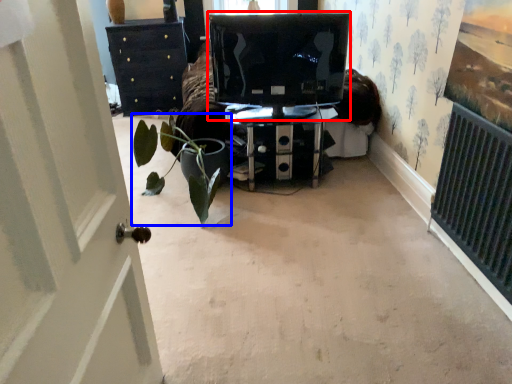
Question: Among these objects, which one is farthest to the camera, computer monitor (highlighted by a red box) or houseplant (highlighted by a blue box)?

Choices:
 (A) computer monitor
 (B) houseplant

Answer: (A)